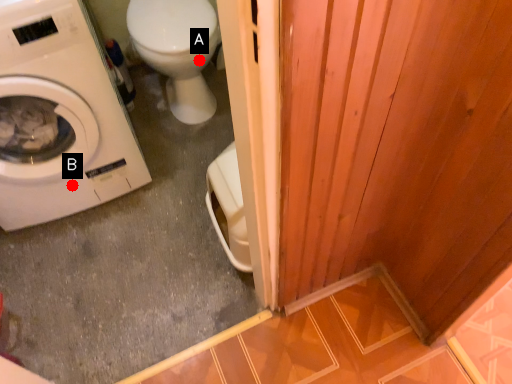
Question: Two points are circled on the image, labeled by A and B beside each circle. Among these points, which one is nearest to the camera?

Choices:
 (A) A is closer
 (B) B is closer

Answer: (B)